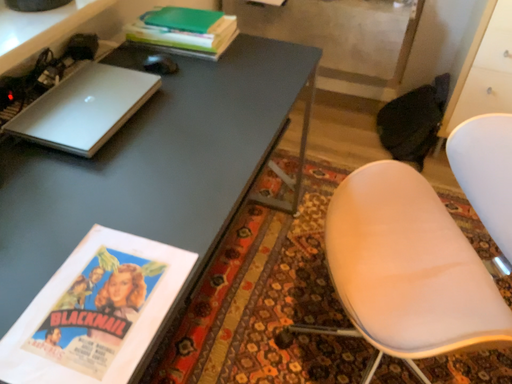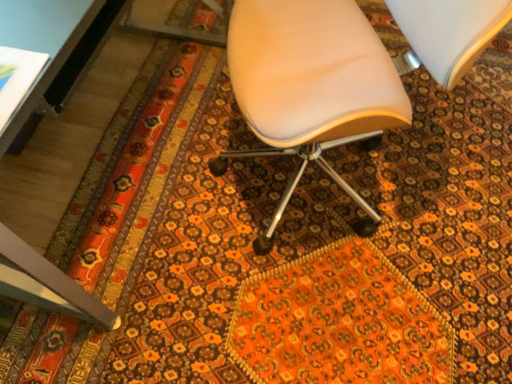
Question: How did the camera likely rotate when shooting the video?

Choices:
 (A) rotated upward
 (B) rotated downward

Answer: (B)